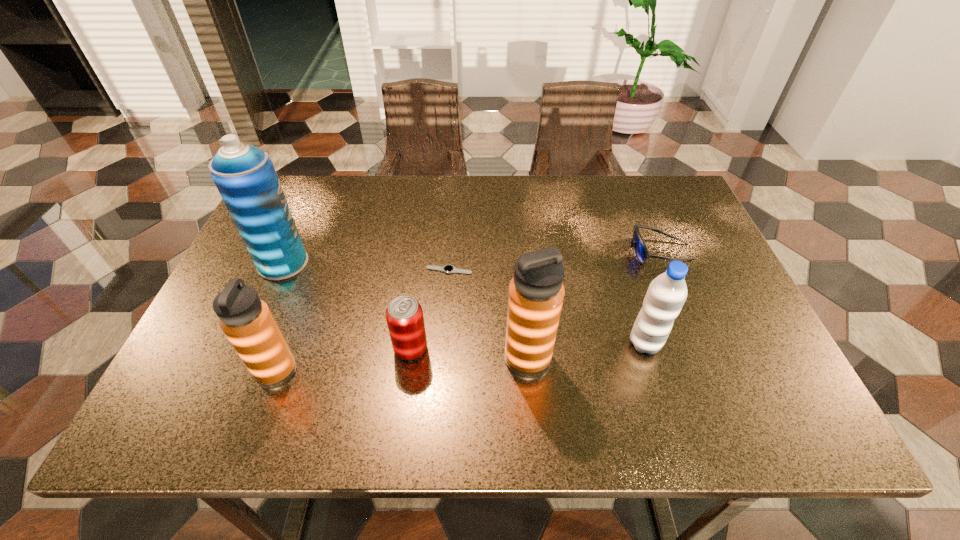
Identify the location of empty space that is in between the water bottle and the left thermos bottle. Image resolution: width=960 pixels, height=540 pixels. (461, 357).

Identify the location of free spot between the shorter thermos bottle and the water bottle. The image size is (960, 540). (461, 357).

Find the location of a particular element. free space that is in between the aerosol can and the sixth tallest object is located at coordinates (471, 257).

Identify the location of free space that is in between the water bottle and the left thermos bottle. This screenshot has height=540, width=960. (461, 357).

Locate an element on the screen. This screenshot has height=540, width=960. unoccupied area between the water bottle and the second tallest object is located at coordinates (587, 350).

In order to click on vacant space in between the third shortest object and the shorter thermos bottle in this screenshot , I will do `click(344, 360)`.

I want to click on object that can be found as the fourth closest to the third object from right to left, so click(x=641, y=252).

Find the location of `object that is the third closest to the second shortest object`. object that is the third closest to the second shortest object is located at coordinates (448, 269).

You are a GUI agent. You are given a task and a screenshot of the screen. Output one action in this format:
    pyautogui.click(x=<x>, y=<y>)
    Task: Click on the vacant area that satisfies the following two spatial constraints: 1. on the front-facing side of the second shortest object; 2. on the front side of the right thermos bottle
    The image size is (960, 540).
    Given the screenshot: What is the action you would take?
    pyautogui.click(x=706, y=358)

Find the location of a particular element. The image size is (960, 540). vacant region that satisfies the following two spatial constraints: 1. on the back side of the water bottle; 2. on the left side of the shorter thermos bottle is located at coordinates (287, 343).